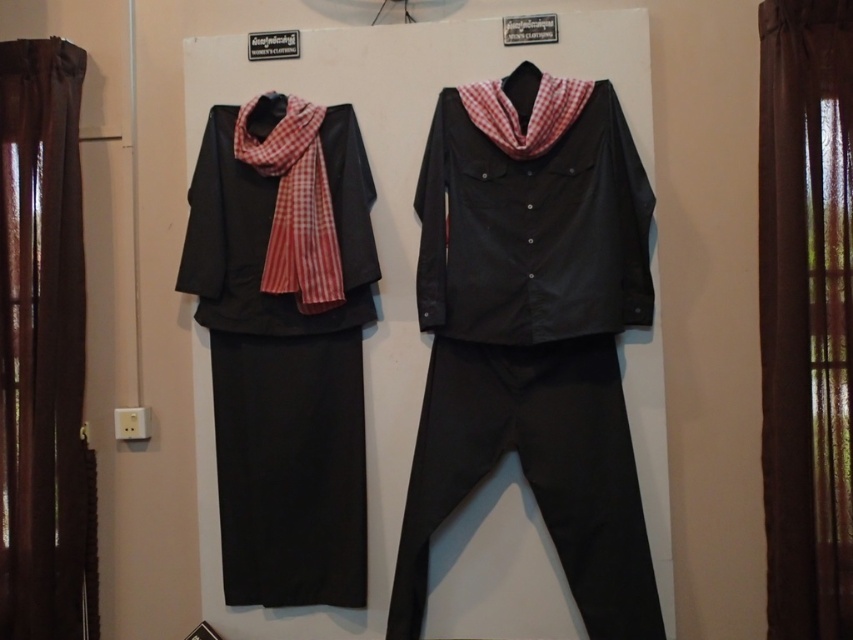
Between red checkered scarf at left and red checkered scarf at center, which one appears on the right side from the viewer's perspective?

red checkered scarf at center is more to the right.

Looking at this image, is red checkered scarf at left thinner than red checkered scarf at center?

Yes, red checkered scarf at left is thinner than red checkered scarf at center.

The width and height of the screenshot is (853, 640). I want to click on red checkered scarf at left, so click(296, 205).

At what (x,y) coordinates should I click in order to perform the action: click on red checkered scarf at left. Please return your answer as a coordinate pair (x, y). Image resolution: width=853 pixels, height=640 pixels. Looking at the image, I should click on (296, 205).

Is the position of matte black shirt at center less distant than that of matte black jacket at center?

No, it is behind matte black jacket at center.

Which is more to the left, matte black shirt at center or matte black jacket at center?

Positioned to the left is matte black shirt at center.

You are a GUI agent. You are given a task and a screenshot of the screen. Output one action in this format:
    pyautogui.click(x=<x>, y=<y>)
    Task: Click on the matte black shirt at center
    
    Given the screenshot: What is the action you would take?
    pyautogui.click(x=532, y=333)

The width and height of the screenshot is (853, 640). I want to click on matte black shirt at center, so click(x=532, y=333).

How much distance is there between matte black jacket at center and red checkered scarf at left?

matte black jacket at center is 17.14 inches from red checkered scarf at left.

The width and height of the screenshot is (853, 640). In order to click on matte black jacket at center in this screenshot , I will do `click(532, 230)`.

In order to click on matte black jacket at center in this screenshot , I will do `click(532, 230)`.